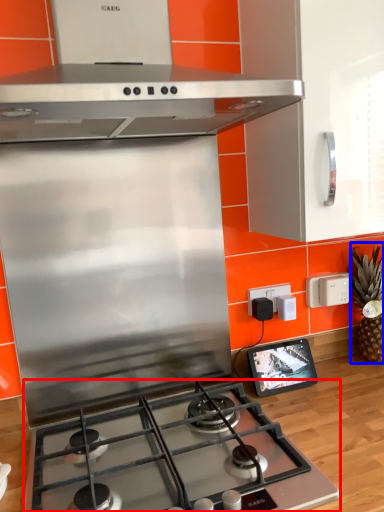
Question: Which point is closer to the camera, gas stove (highlighted by a red box) or pineapple (highlighted by a blue box)?

Choices:
 (A) gas stove
 (B) pineapple

Answer: (A)